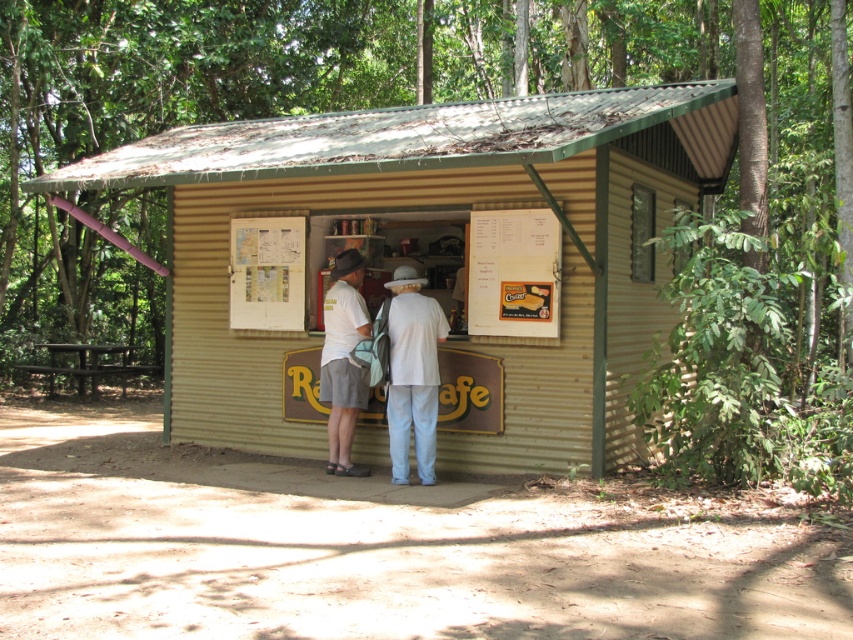
Is corrugated metal hut at center shorter than matte white shirt at center?

Yes, corrugated metal hut at center is shorter than matte white shirt at center.

Consider the image. Is corrugated metal hut at center above matte white shirt at center?

Correct, corrugated metal hut at center is located above matte white shirt at center.

Locate an element on the screen. The height and width of the screenshot is (640, 853). corrugated metal hut at center is located at coordinates (430, 253).

You are a GUI agent. You are given a task and a screenshot of the screen. Output one action in this format:
    pyautogui.click(x=<x>, y=<y>)
    Task: Click on the corrugated metal hut at center
    
    Given the screenshot: What is the action you would take?
    pyautogui.click(x=430, y=253)

Does corrugated metal hut at center have a lesser width compared to white cotton shirt at center?

Correct, corrugated metal hut at center's width is less than white cotton shirt at center's.

This screenshot has width=853, height=640. I want to click on corrugated metal hut at center, so click(x=430, y=253).

Who is more distant from viewer, [431,444] or [334,467]?

The point [334,467] is more distant.

Can you confirm if white cotton shirt at center is bigger than matte white shirt at center?

Indeed, white cotton shirt at center has a larger size compared to matte white shirt at center.

Describe the element at coordinates (413, 372) in the screenshot. I see `white cotton shirt at center` at that location.

You are a GUI agent. You are given a task and a screenshot of the screen. Output one action in this format:
    pyautogui.click(x=<x>, y=<y>)
    Task: Click on the white cotton shirt at center
    The width and height of the screenshot is (853, 640).
    Given the screenshot: What is the action you would take?
    pyautogui.click(x=413, y=372)